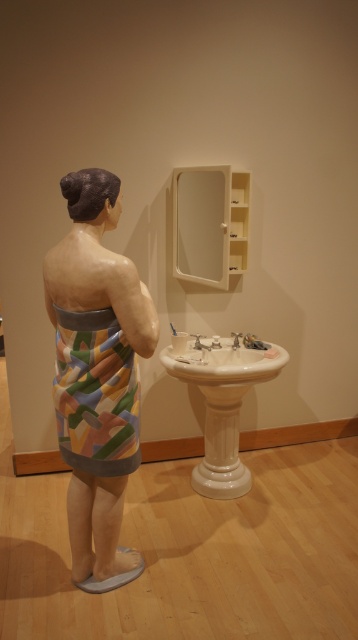
Which is behind, point (124, 291) or point (224, 346)?

Point (224, 346)

Can you confirm if painted fabric towel at center is smaller than white porcelain sink at lower center?

No, painted fabric towel at center is not smaller than white porcelain sink at lower center.

At what (x,y) coordinates should I click in order to perform the action: click on painted fabric towel at center. Please return your answer as a coordinate pair (x, y). The width and height of the screenshot is (358, 640). Looking at the image, I should click on click(x=97, y=374).

Is white porcelain sink at lower center positioned before silver metallic faucet at lower center?

Yes.

Is white porcelain sink at lower center further to camera compared to silver metallic faucet at lower center?

No, it is not.

Which is behind, point (283, 360) or point (236, 342)?

The point (236, 342) is more distant.

Image resolution: width=358 pixels, height=640 pixels. Find the location of `white porcelain sink at lower center`. white porcelain sink at lower center is located at coordinates (224, 364).

Measure the distance between painted fabric towel at center and camera.

A distance of 1.80 meters exists between painted fabric towel at center and camera.

Is point (119, 561) positioned after point (195, 336)?

That is False.

At what (x,y) coordinates should I click in order to perform the action: click on painted fabric towel at center. Please return your answer as a coordinate pair (x, y). This screenshot has height=640, width=358. Looking at the image, I should click on (97, 374).